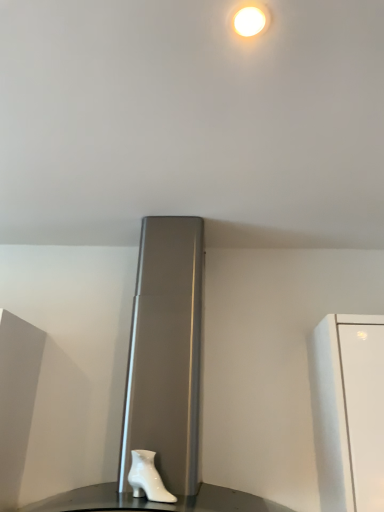
Question: Should I look upward or downward to see white glossy boot at lower center?

Choices:
 (A) up
 (B) down

Answer: (B)